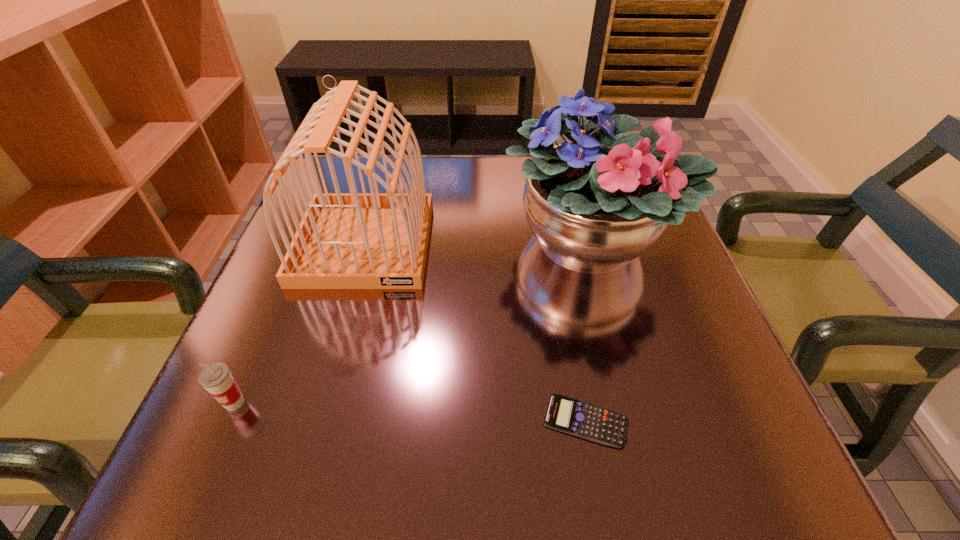
I want to click on free space between the cup and the bouquet, so click(x=412, y=323).

The width and height of the screenshot is (960, 540). In order to click on blank region between the birdcage and the second shortest object in this screenshot , I will do `click(300, 323)`.

Identify which object is the second nearest to the third shortest object. Please provide its 2D coordinates. Your answer should be formatted as a tuple, i.e. [(x, y)], where the tuple contains the x and y coordinates of a point satisfying the conditions above.

[(595, 423)]

Locate an element on the screen. the closest object to the second tallest object is located at coordinates (353, 240).

This screenshot has height=540, width=960. Identify the location of free region that satisfies the following two spatial constraints: 1. on the side of the cup with the logo; 2. on the right side of the shortest object. (227, 420).

You are a GUI agent. You are given a task and a screenshot of the screen. Output one action in this format:
    pyautogui.click(x=<x>, y=<y>)
    Task: Click on the free space that satisfies the following two spatial constraints: 1. on the side of the second shortest object with the logo; 2. on the left side of the shortest object
    The height and width of the screenshot is (540, 960).
    Given the screenshot: What is the action you would take?
    pyautogui.click(x=227, y=420)

You are a GUI agent. You are given a task and a screenshot of the screen. Output one action in this format:
    pyautogui.click(x=<x>, y=<y>)
    Task: Click on the vacant space that satisfies the following two spatial constraints: 1. on the side of the calculator with the logo; 2. on the right side of the cup
    This screenshot has width=960, height=540.
    Given the screenshot: What is the action you would take?
    [x=227, y=420]

This screenshot has height=540, width=960. What are the coordinates of `vacant space that satisfies the following two spatial constraints: 1. with an open door on the birdcage; 2. on the left side of the third shortest object` in the screenshot? It's located at (365, 244).

You are a GUI agent. You are given a task and a screenshot of the screen. Output one action in this format:
    pyautogui.click(x=<x>, y=<y>)
    Task: Click on the free space that satisfies the following two spatial constraints: 1. with an open door on the calculator; 2. on the right side of the birdcage
    The height and width of the screenshot is (540, 960).
    Given the screenshot: What is the action you would take?
    pyautogui.click(x=315, y=420)

Identify the location of vacant space that satisfies the following two spatial constraints: 1. with an open door on the birdcage; 2. on the left side of the third shortest object. The height and width of the screenshot is (540, 960). (365, 244).